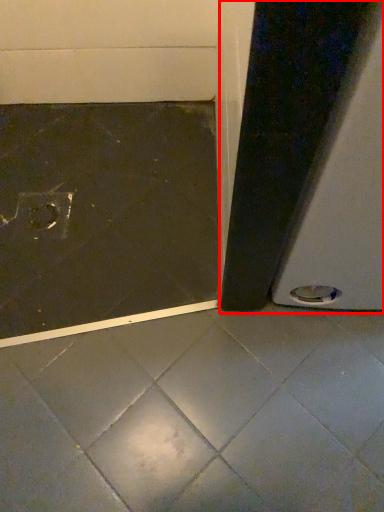
Question: From the image's perspective, what is the correct spatial positioning of screen door (annotated by the red box) in reference to concrete?

Choices:
 (A) below
 (B) above

Answer: (B)